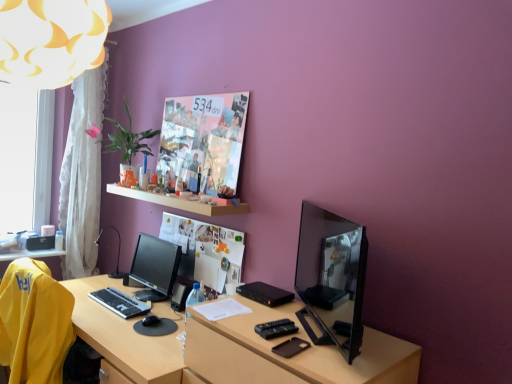
The image size is (512, 384). Identify the location of vacant area that is in front of black plastic keyboard at lower left. (104, 312).